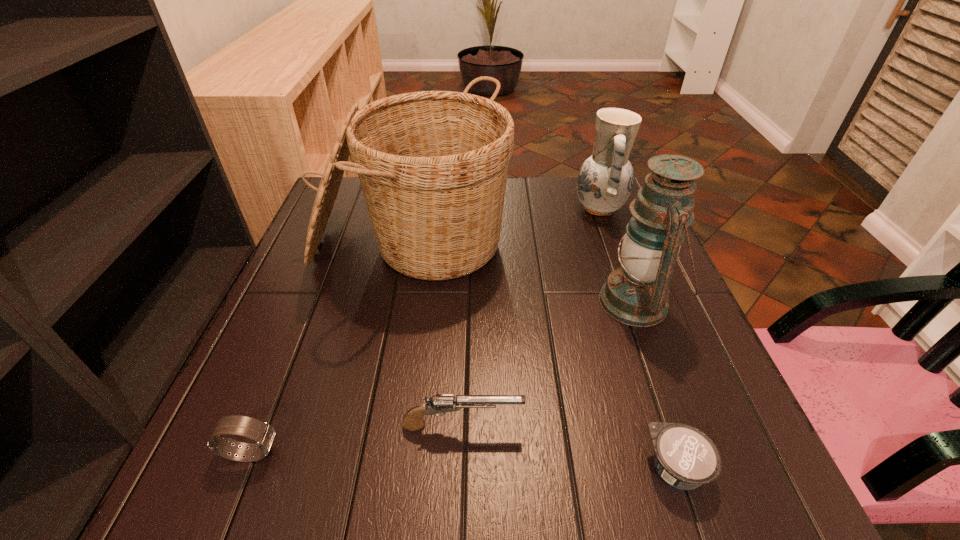
I want to click on vacant space that satisfies the following two spatial constraints: 1. on either side of the pottery; 2. on the left side of the oil lamp, so click(633, 302).